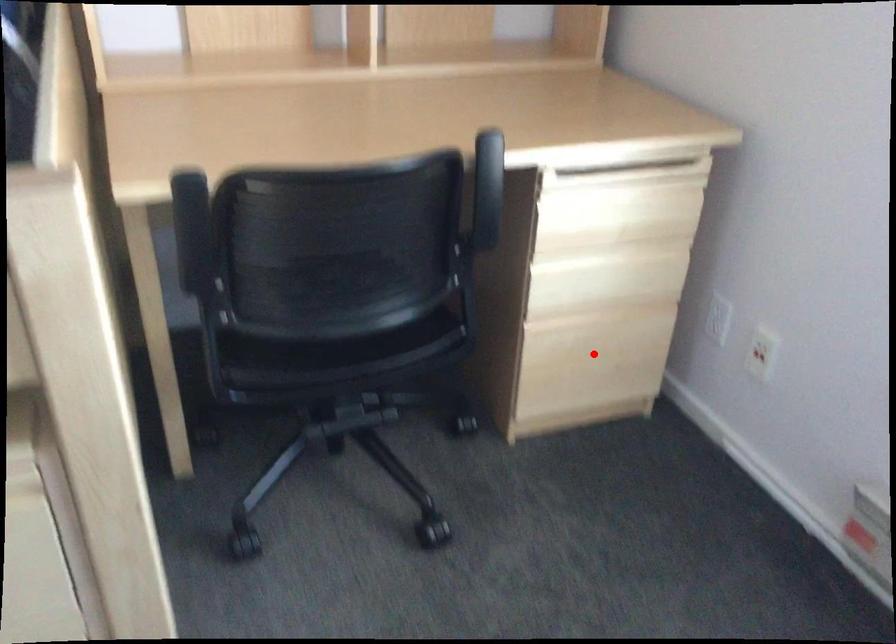
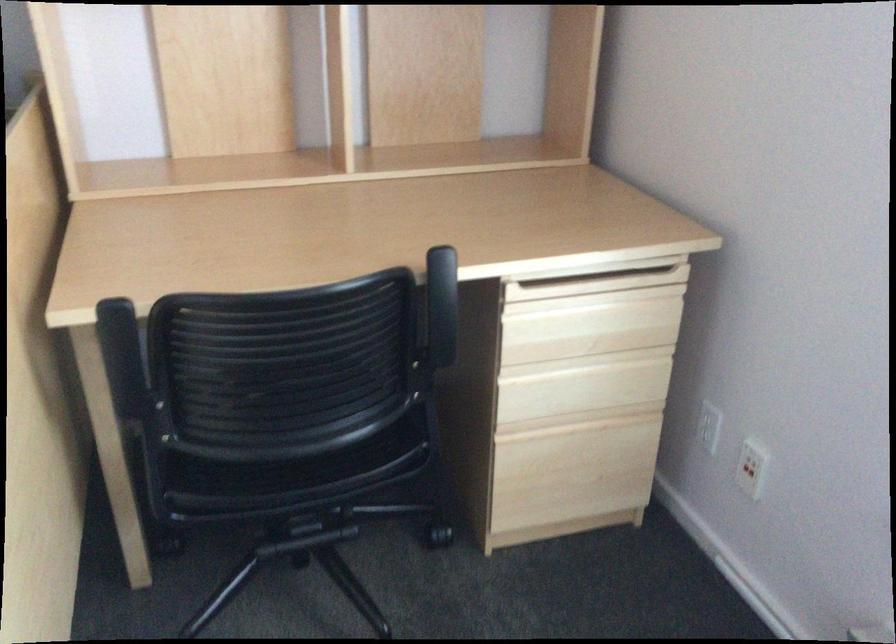
Find the pixel in the second image that matches the highlighted location in the first image.

(574, 465)